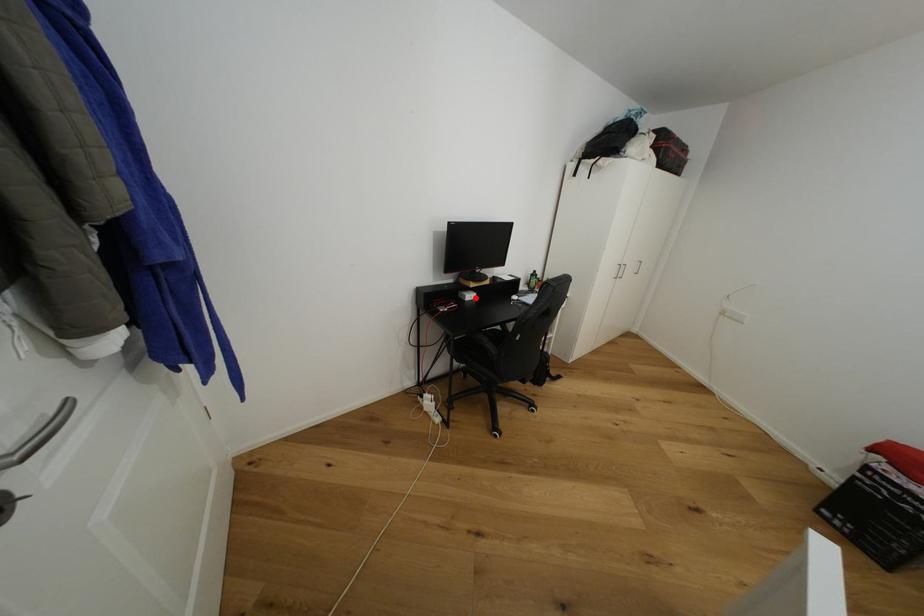
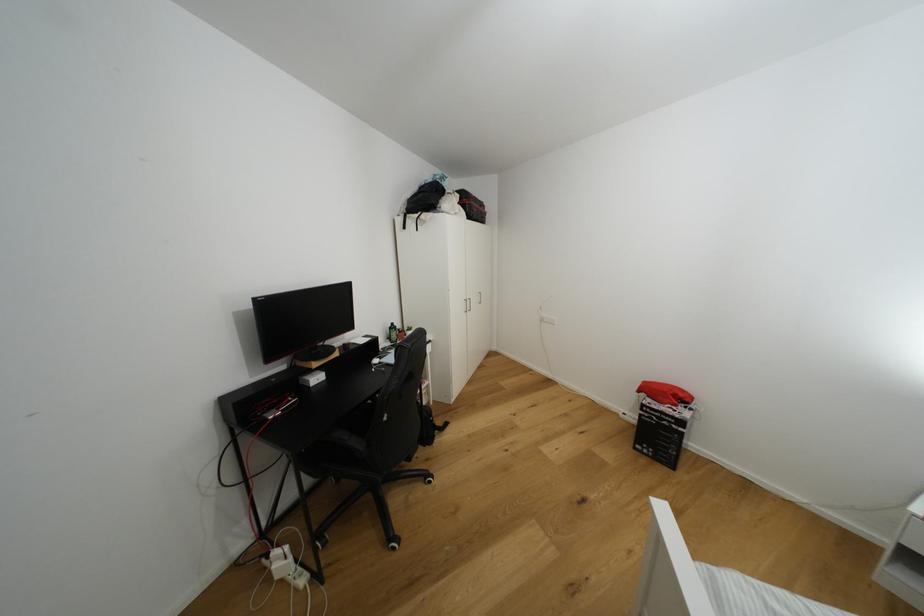
The point at the highlighted location is marked in the first image. Where is the corresponding point in the second image?

(322, 379)